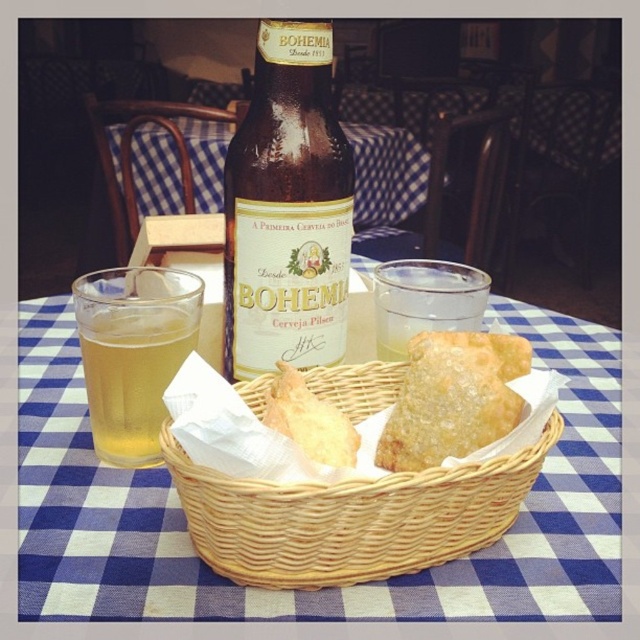
What object is located at the coordinates point (288, 209)?

The brown glass bottle at center is located at point (288, 209).

You are a customer at the restaurant and want to grab the woven basket at center. Where should you look to find it?

The woven basket at center is located at point (324, 588).

Based on the photo, you are a server at the restaurant and need to place a new order of fried snacks on the table. The table has a blue and white checkered tablecloth. There is a woven basket at center and a clear glass at center. Which object should you place the snacks in to ensure they stay warm, considering their size and the available space?

The woven basket at center is wider than the clear glass at center, so placing the snacks in the woven basket at center would provide enough space and help retain heat better.